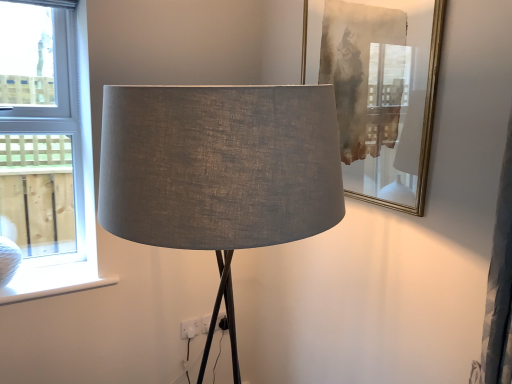
Question: Can you confirm if white plastic window at left is wider than white plastic electric outlet at lower center?

Choices:
 (A) no
 (B) yes

Answer: (B)

Question: From a real-world perspective, is white plastic window at left located beneath white plastic electric outlet at lower center?

Choices:
 (A) yes
 (B) no

Answer: (B)

Question: Is white plastic window at left beside white plastic electric outlet at lower center?

Choices:
 (A) yes
 (B) no

Answer: (B)

Question: Does white plastic window at left have a larger size compared to white plastic electric outlet at lower center?

Choices:
 (A) yes
 (B) no

Answer: (A)

Question: Is white plastic window at left located outside white plastic electric outlet at lower center?

Choices:
 (A) no
 (B) yes

Answer: (B)

Question: Would you say white plastic electric outlet at lower center is part of white plastic window at left's contents?

Choices:
 (A) yes
 (B) no

Answer: (B)

Question: Is matte gray fabric lampshade at center bigger than white matte window sill at lower left?

Choices:
 (A) yes
 (B) no

Answer: (A)

Question: From the image's perspective, would you say matte gray fabric lampshade at center is shown under white matte window sill at lower left?

Choices:
 (A) no
 (B) yes

Answer: (A)

Question: Can you confirm if matte gray fabric lampshade at center is positioned to the right of white matte window sill at lower left?

Choices:
 (A) no
 (B) yes

Answer: (B)

Question: Are matte gray fabric lampshade at center and white matte window sill at lower left beside each other?

Choices:
 (A) yes
 (B) no

Answer: (B)

Question: Can you confirm if matte gray fabric lampshade at center is thinner than white matte window sill at lower left?

Choices:
 (A) no
 (B) yes

Answer: (A)

Question: From a real-world perspective, is matte gray fabric lampshade at center on top of white matte window sill at lower left?

Choices:
 (A) yes
 (B) no

Answer: (A)

Question: Are matte gold picture frame at upper right and white plastic electric outlet at lower center located far from each other?

Choices:
 (A) no
 (B) yes

Answer: (B)